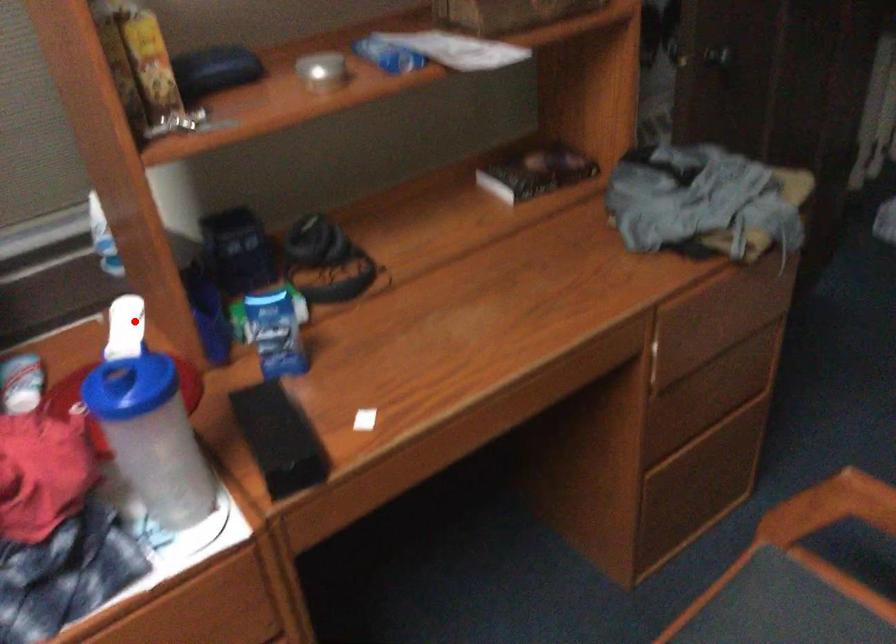
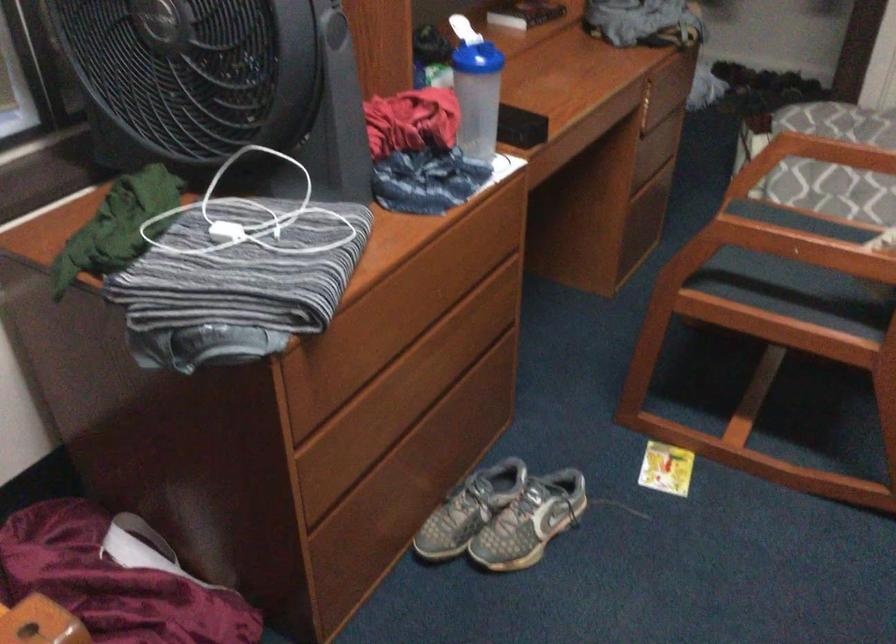
The point at the highlighted location is marked in the first image. Where is the corresponding point in the second image?

(462, 29)